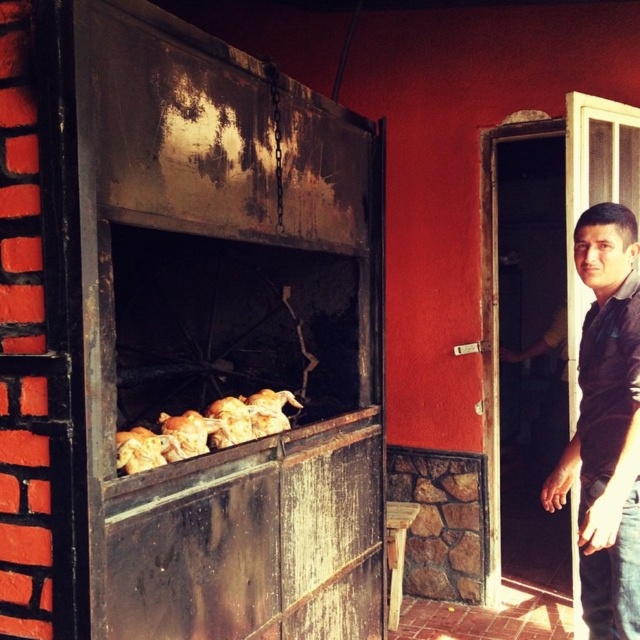
Between point (624, 518) and point (170, 454), which one is positioned in front?

Point (170, 454) is more forward.

Is black shirt at right shorter than golden crispy chicken at center?

No.

What do you see at coordinates (605, 426) in the screenshot? The width and height of the screenshot is (640, 640). I see `black shirt at right` at bounding box center [605, 426].

This screenshot has width=640, height=640. I want to click on black shirt at right, so click(605, 426).

Which is below, golden brown crispy chicken at center or golden crispy chicken at center?

golden crispy chicken at center

Between point (285, 394) and point (218, 426), which one is positioned behind?

Point (285, 394)

Locate an element on the screen. The image size is (640, 640). golden brown crispy chicken at center is located at coordinates (204, 429).

At what (x,y) coordinates should I click in order to perform the action: click on golden crispy chicken at center. Please return your answer as a coordinate pair (x, y). Looking at the image, I should click on (186, 435).

Is golden crispy chicken at center to the left of golden crispy chicken at lower left from the viewer's perspective?

In fact, golden crispy chicken at center is to the right of golden crispy chicken at lower left.

Does point (173, 433) lie behind point (129, 436)?

Yes, it is.

The width and height of the screenshot is (640, 640). I want to click on golden crispy chicken at center, so click(x=186, y=435).